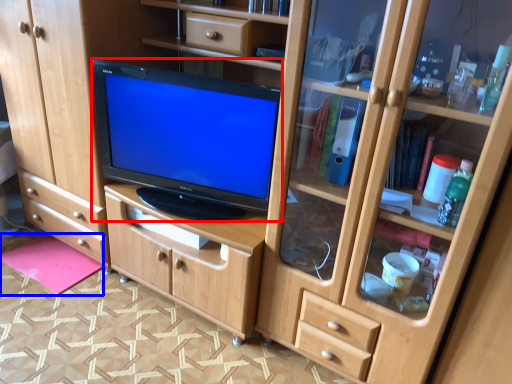
Question: Which object is further to the camera taking this photo, television (highlighted by a red box) or flat (highlighted by a blue box)?

Choices:
 (A) television
 (B) flat

Answer: (B)